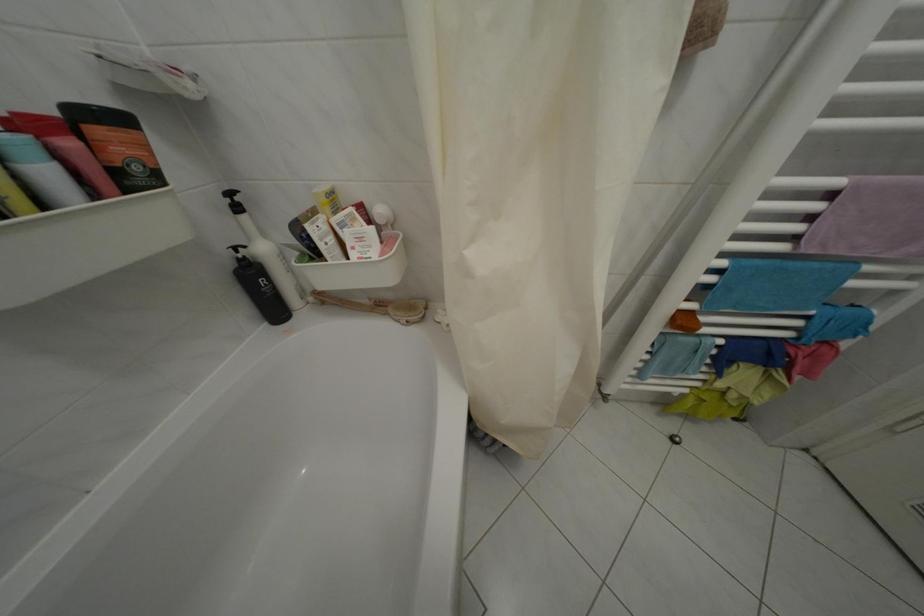
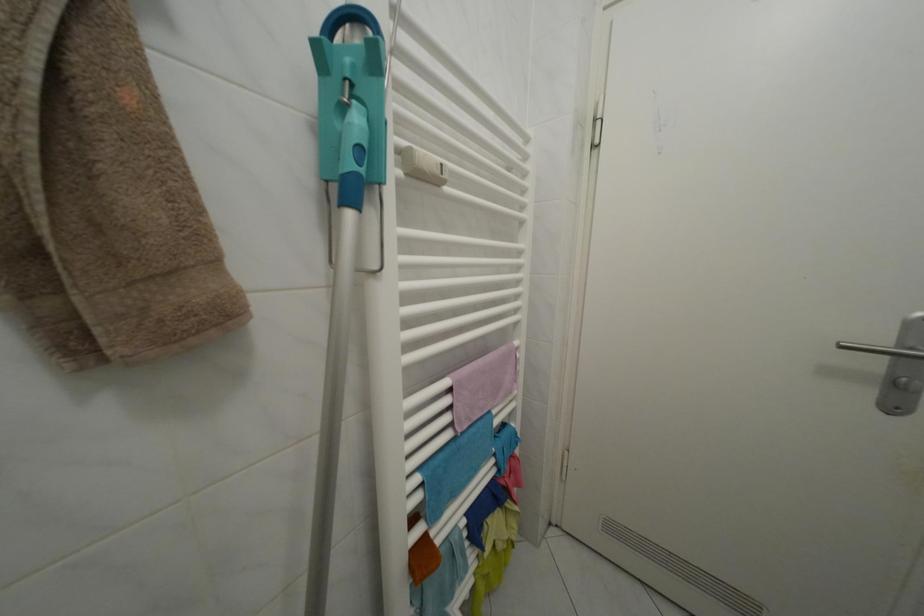
The point at (x=732, y=270) is marked in the first image. Where is the corresponding point in the second image?

(427, 485)